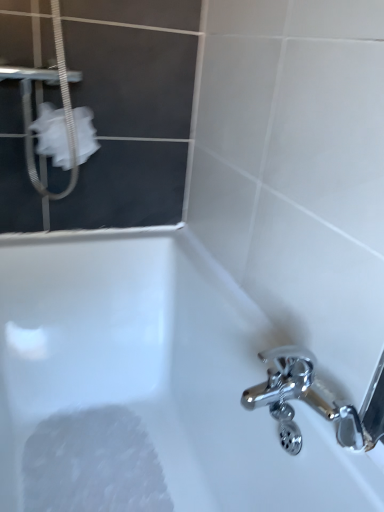
Question: Is the position of white fabric screen door at upper left more distant than that of white foamy at bottom left?

Choices:
 (A) yes
 (B) no

Answer: (B)

Question: Can you see white fabric screen door at upper left touching white foamy at bottom left?

Choices:
 (A) yes
 (B) no

Answer: (B)

Question: Is white foamy at bottom left located within white fabric screen door at upper left?

Choices:
 (A) yes
 (B) no

Answer: (B)

Question: Does white fabric screen door at upper left lie in front of white foamy at bottom left?

Choices:
 (A) no
 (B) yes

Answer: (B)

Question: From a real-world perspective, is white fabric screen door at upper left physically below white foamy at bottom left?

Choices:
 (A) yes
 (B) no

Answer: (B)

Question: From a real-world perspective, is white fabric screen door at upper left physically above white foamy at bottom left?

Choices:
 (A) yes
 (B) no

Answer: (A)

Question: Considering the relative positions of white fabric screen door at upper left and white glossy bathtub at lower left in the image provided, is white fabric screen door at upper left to the right of white glossy bathtub at lower left from the viewer's perspective?

Choices:
 (A) yes
 (B) no

Answer: (B)

Question: Is the position of white fabric screen door at upper left more distant than that of white glossy bathtub at lower left?

Choices:
 (A) no
 (B) yes

Answer: (B)

Question: Considering the relative positions of white fabric screen door at upper left and white glossy bathtub at lower left in the image provided, is white fabric screen door at upper left to the left of white glossy bathtub at lower left from the viewer's perspective?

Choices:
 (A) no
 (B) yes

Answer: (B)

Question: From the image's perspective, is white fabric screen door at upper left over white glossy bathtub at lower left?

Choices:
 (A) no
 (B) yes

Answer: (B)

Question: Is white fabric screen door at upper left positioned before white glossy bathtub at lower left?

Choices:
 (A) yes
 (B) no

Answer: (B)

Question: From a real-world perspective, is white fabric screen door at upper left located beneath white glossy bathtub at lower left?

Choices:
 (A) yes
 (B) no

Answer: (B)

Question: Is the depth of white fabric at upper left greater than that of white glossy bathtub at lower left?

Choices:
 (A) no
 (B) yes

Answer: (B)